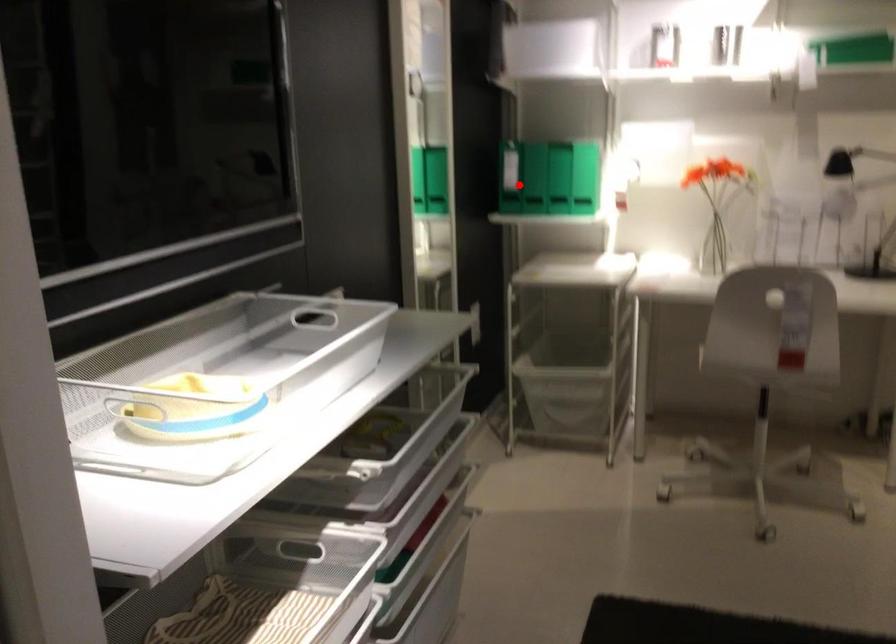
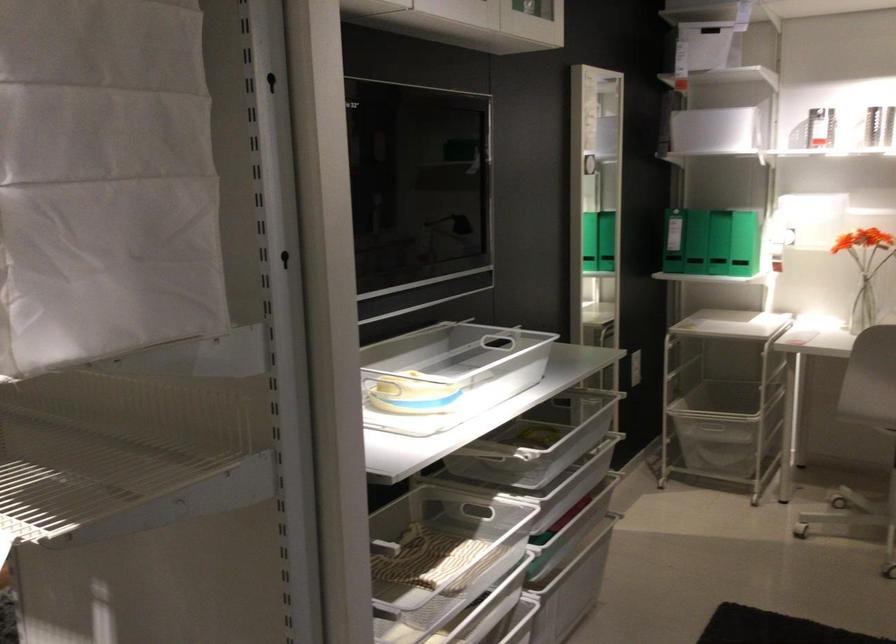
Where in the second image is the point corresponding to the highlighted location from the first image?

(695, 242)